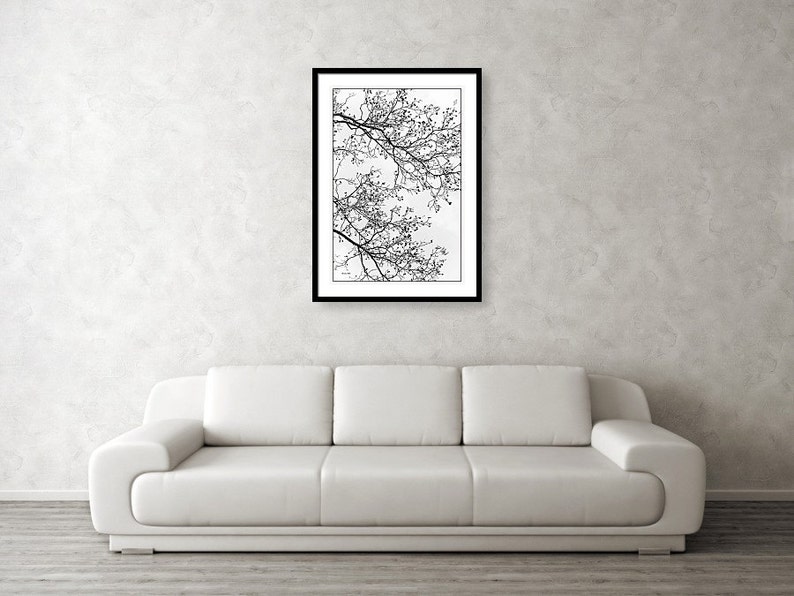
Locate an element on the screen. Image resolution: width=794 pixels, height=596 pixels. tree branches in picture is located at coordinates (406, 156), (376, 242).